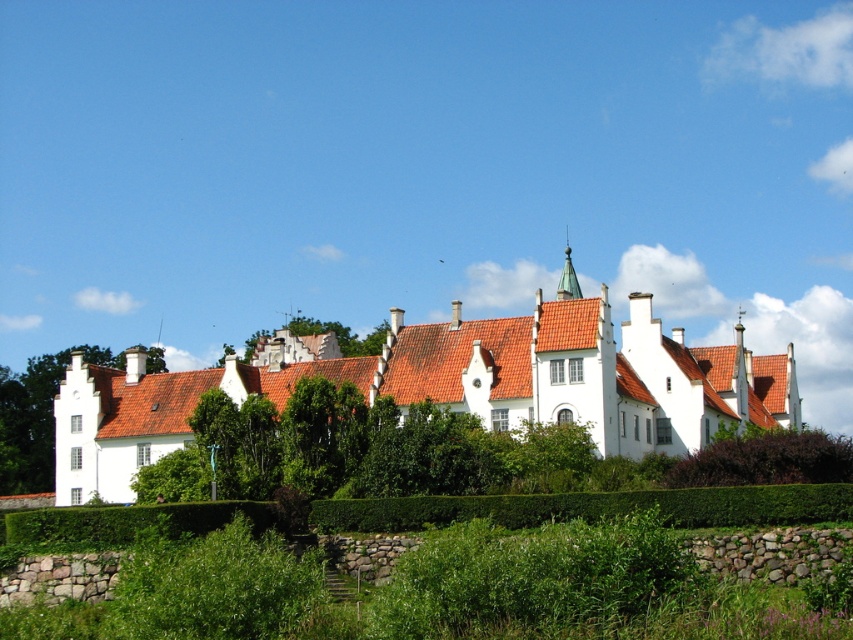
You are standing in front of the white building and want to plant a new tree that needs more space. Which tree among the green leafy tree at left and the green leafy tree at center should you consider for removal to free up space?

The green leafy tree at left has a larger size compared to the green leafy tree at center, so removing it would free up more space.

You are standing in the garden in front of the white building and want to take a photo of the green leafy tree at left and the green leafy hedge at center. Which object is closer to you, the photographer?

The green leafy tree at left is closer to you than the green leafy hedge at center, which is positioned behind it.